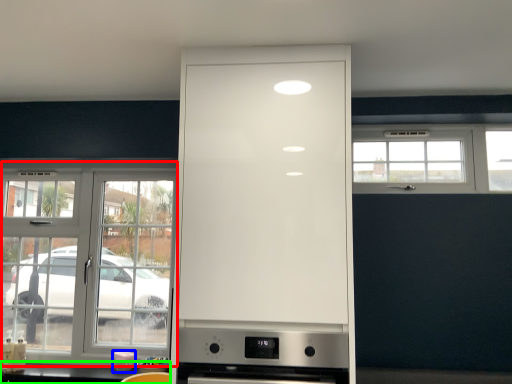
Question: Which object is the farthest from window (highlighted by a red box)? Choose among these: appliance (highlighted by a blue box) or counter top (highlighted by a green box).

Choices:
 (A) appliance
 (B) counter top

Answer: (A)